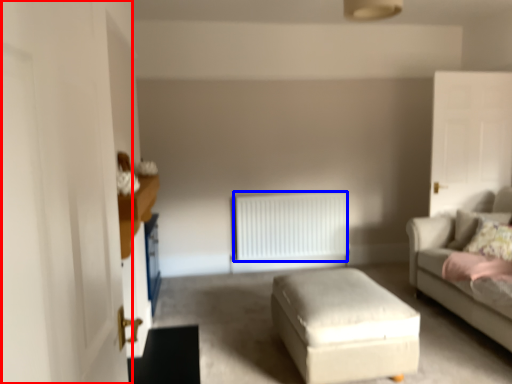
Question: Among these objects, which one is nearest to the camera, glass door (highlighted by a red box) or radiator (highlighted by a blue box)?

Choices:
 (A) glass door
 (B) radiator

Answer: (A)